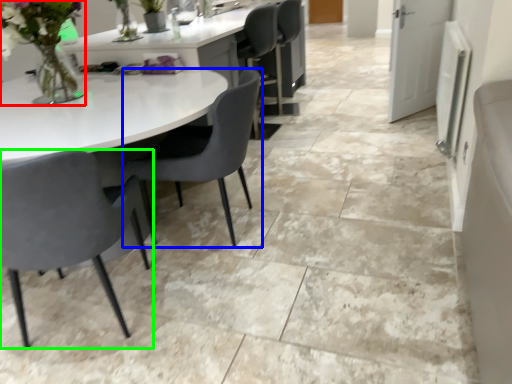
Question: Based on their relative distances, which object is nearer to floral arrangement (highlighted by a red box)? Choose from chair (highlighted by a blue box) and chair (highlighted by a green box).

Choices:
 (A) chair
 (B) chair

Answer: (A)